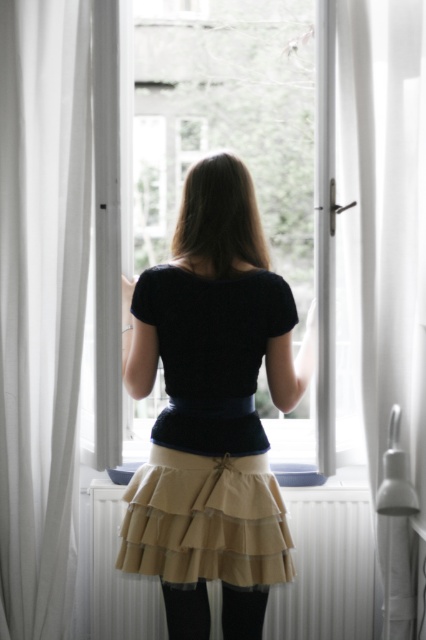
Question: Which of the following is the closest to the observer?

Choices:
 (A) transparent glass window at center
 (B) black mesh tights at lower center
 (C) black cotton shirt at center
 (D) white sheer curtain at left

Answer: (C)

Question: Can you confirm if white sheer curtain at left is positioned below transparent glass window at center?

Choices:
 (A) no
 (B) yes

Answer: (B)

Question: Estimate the real-world distances between objects in this image. Which object is closer to the black cotton shirt at center?

Choices:
 (A) black mesh tights at lower center
 (B) white sheer curtain at left
 (C) transparent glass window at center

Answer: (A)

Question: Is black cotton shirt at center smaller than black mesh tights at lower center?

Choices:
 (A) no
 (B) yes

Answer: (A)

Question: Does white sheer curtain at left appear over black mesh tights at lower center?

Choices:
 (A) no
 (B) yes

Answer: (B)

Question: Which of the following is the closest to the observer?

Choices:
 (A) white sheer curtain at left
 (B) transparent glass window at center

Answer: (A)